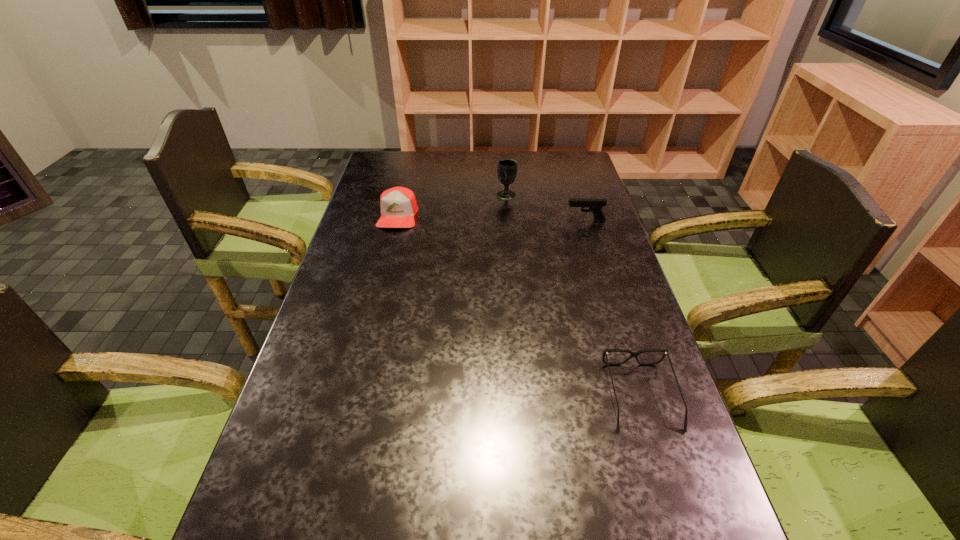
Identify which object is located as the third nearest to the pistol. Please provide its 2D coordinates. Your answer should be formatted as a tuple, i.e. [(x, y)], where the tuple contains the x and y coordinates of a point satisfying the conditions above.

[(633, 354)]